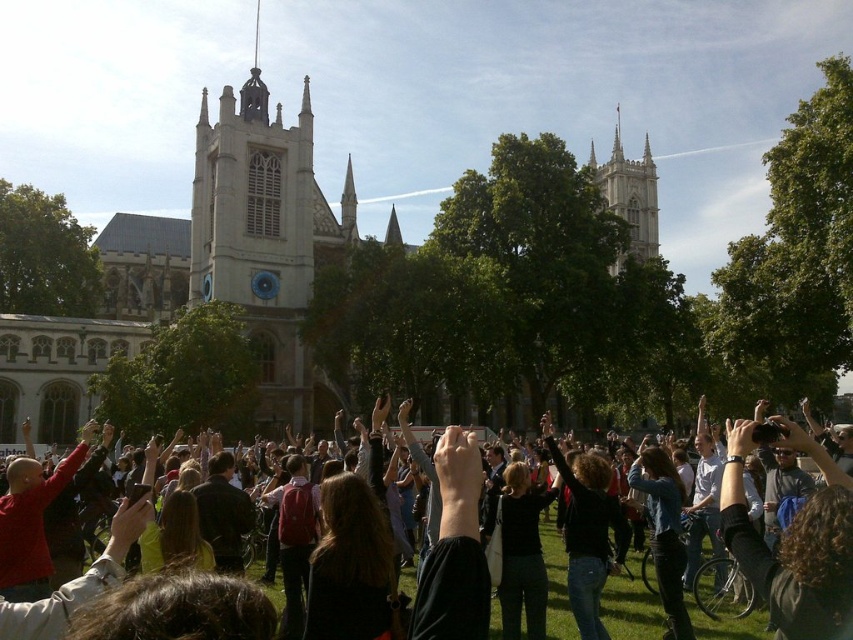
You are a photographer trying to capture the entire stone church at center and dark brown hair at center in a single photo. Based on their widths, which object should you frame first to ensure both fit in the photo?

Since the stone church at center is wider than dark brown hair at center, you should frame the stone church at center first to ensure both fit in the photo.

From the picture: You are an architect analyzing the spatial layout of the scene. Given that the stone church at center and the white stone tower at upper right are both part of the historic building complex, which structure occupies more horizontal space in the image?

The stone church at center occupies more horizontal space than the white stone tower at upper right because its width is larger than the tower.

You are a photographer planning to take a wide shot of the stone church at center and the white stone tower at upper right. Given their sizes, which one will occupy more space in your photo?

The stone church at center will occupy more space in the photo because it has a larger size compared to the white stone tower at upper right.